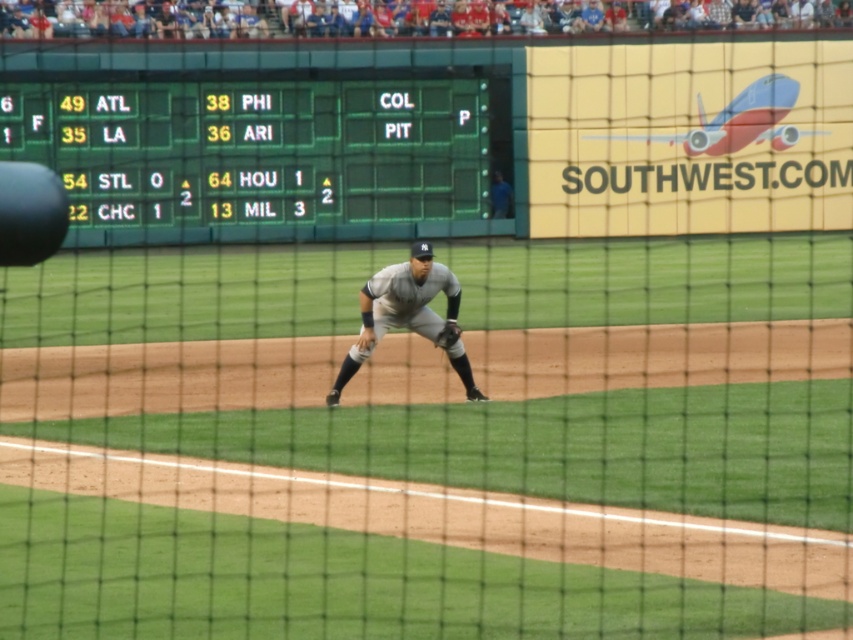
Question: Among these objects, which one is farthest from the camera?

Choices:
 (A) green plastic scoreboard at upper left
 (B) dark brown leather glove at center
 (C) gray uniformed baseball player at center

Answer: (A)

Question: Which of the following is the closest to the observer?

Choices:
 (A) (447, 324)
 (B) (48, 125)

Answer: (A)

Question: Is green plastic scoreboard at upper left wider than gray uniformed baseball player at center?

Choices:
 (A) yes
 (B) no

Answer: (A)

Question: Where is green plastic scoreboard at upper left located in relation to gray uniformed baseball player at center in the image?

Choices:
 (A) below
 (B) above

Answer: (B)

Question: Does green plastic scoreboard at upper left have a smaller size compared to dark brown leather glove at center?

Choices:
 (A) no
 (B) yes

Answer: (A)

Question: Estimate the real-world distances between objects in this image. Which object is farther from the gray uniformed baseball player at center?

Choices:
 (A) dark brown leather glove at center
 (B) green plastic scoreboard at upper left

Answer: (B)